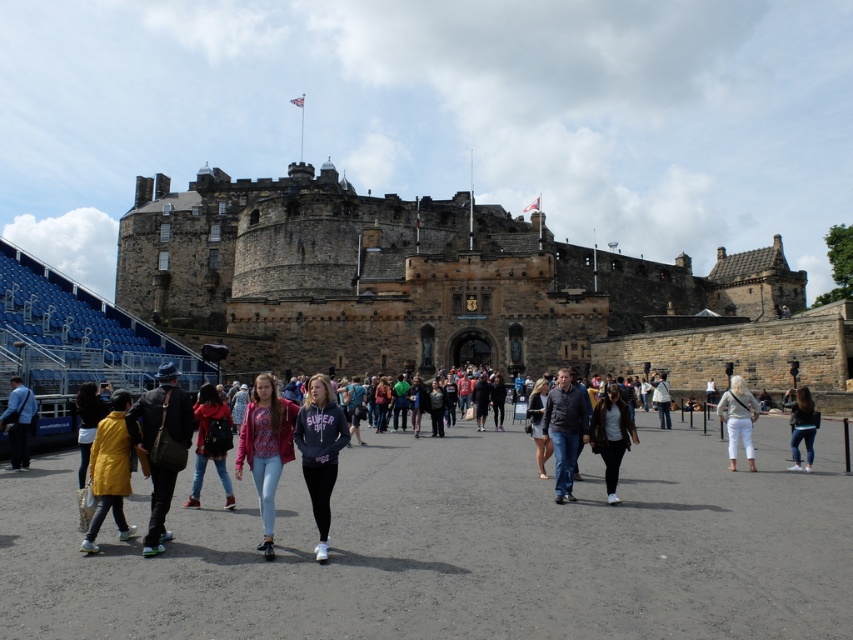
Does matte pink jacket at center have a greater height compared to matte red backpack at center?

Correct, matte pink jacket at center is much taller as matte red backpack at center.

Can you confirm if matte pink jacket at center is bigger than matte red backpack at center?

Indeed, matte pink jacket at center has a larger size compared to matte red backpack at center.

Who is more distant from viewer, (268,481) or (198,420)?

The point (198,420) is behind.

Image resolution: width=853 pixels, height=640 pixels. Identify the location of matte pink jacket at center. (265, 448).

In order to click on matte red backpack at center in this screenshot , I will do `click(210, 444)`.

Image resolution: width=853 pixels, height=640 pixels. What do you see at coordinates (210, 444) in the screenshot?
I see `matte red backpack at center` at bounding box center [210, 444].

I want to click on matte red backpack at center, so click(210, 444).

In the scene shown: Can you confirm if yellow matte jacket at lower left is bigger than white cotton pants at lower right?

Incorrect, yellow matte jacket at lower left is not larger than white cotton pants at lower right.

Does yellow matte jacket at lower left lie in front of white cotton pants at lower right?

Yes, yellow matte jacket at lower left is closer to the viewer.

The height and width of the screenshot is (640, 853). I want to click on yellow matte jacket at lower left, so click(109, 470).